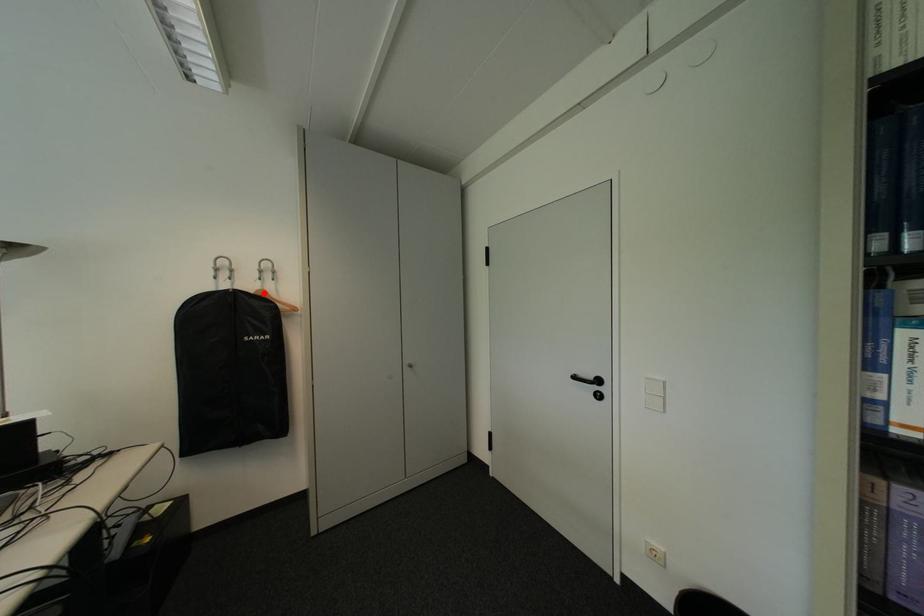
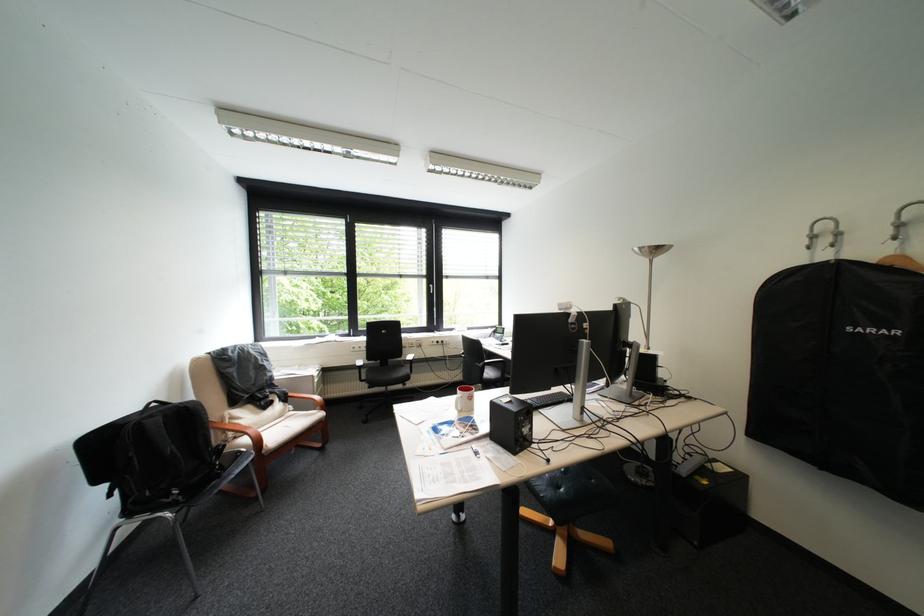
The point at the highlighted location is marked in the first image. Where is the corresponding point in the second image?

(886, 262)